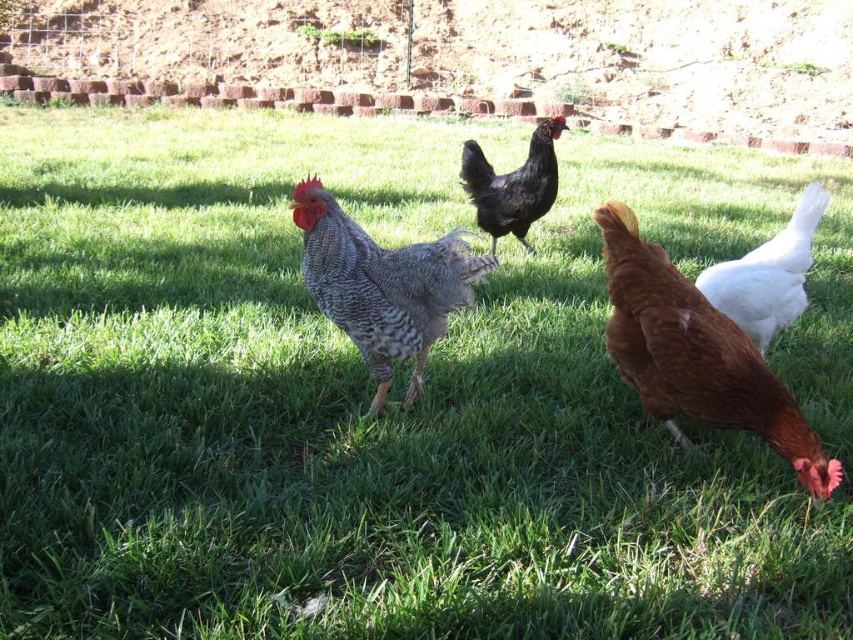
You are a farmer checking the coop and notice the brown matte chicken at lower right and the white glossy chicken at center. Which chicken has a greater width?

The brown matte chicken at lower right has a greater width than the white glossy chicken at center according to the description provided.

You are a farmer checking the flock. You need to identify which chicken is taller between the brown matte chicken at lower right and the speckled feathered rooster at center. Based on the scene, which one is taller?

The brown matte chicken at lower right is taller than the speckled feathered rooster at center according to the description.

You are a farmer checking on your chickens. You notice the brown matte chicken at lower right and the white glossy chicken at center. Which chicken is taller?

The brown matte chicken at lower right is taller than the white glossy chicken at center.